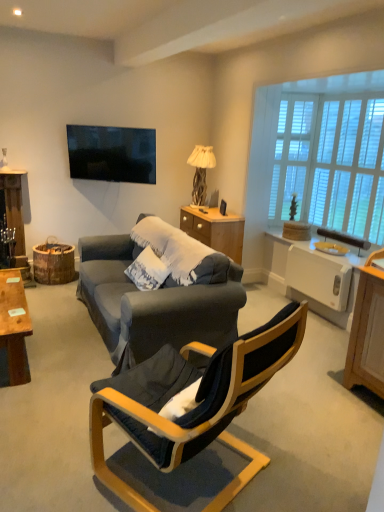
Where is `free spot to the right of velvet dark blue chair at center`? free spot to the right of velvet dark blue chair at center is located at coordinates (309, 447).